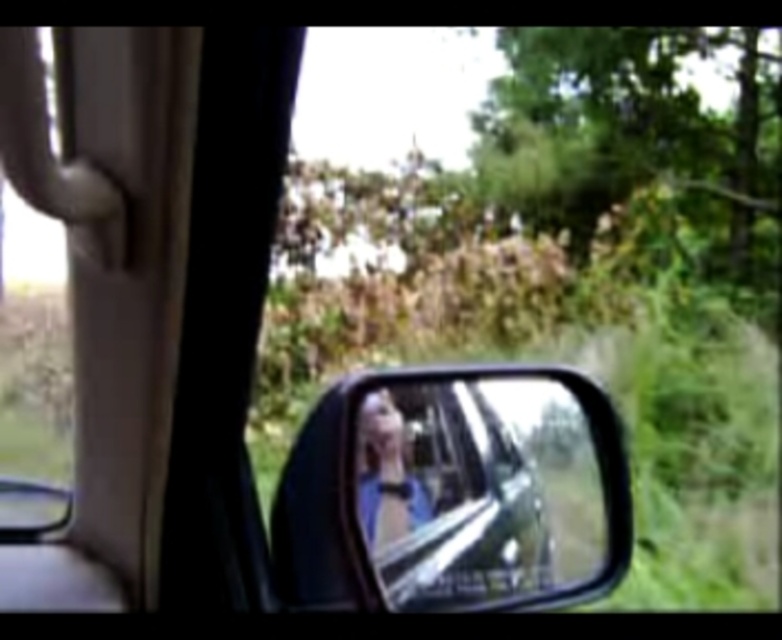
Question: Does glossy metallic mirror at center lie in front of blue fabric person at center?

Choices:
 (A) no
 (B) yes

Answer: (B)

Question: Does glossy metallic mirror at center come in front of blue fabric person at center?

Choices:
 (A) no
 (B) yes

Answer: (B)

Question: Which point is farther from the camera taking this photo?

Choices:
 (A) (386, 497)
 (B) (499, 509)

Answer: (B)

Question: Does glossy metallic mirror at center come in front of blue fabric person at center?

Choices:
 (A) yes
 (B) no

Answer: (A)